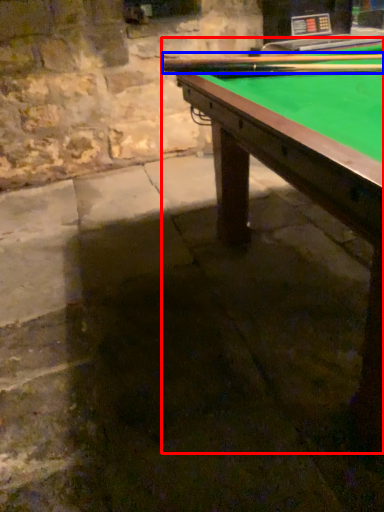
Question: Which of the following is the closest to the observer, billiard table (highlighted by a red box) or cue (highlighted by a blue box)?

Choices:
 (A) billiard table
 (B) cue

Answer: (A)